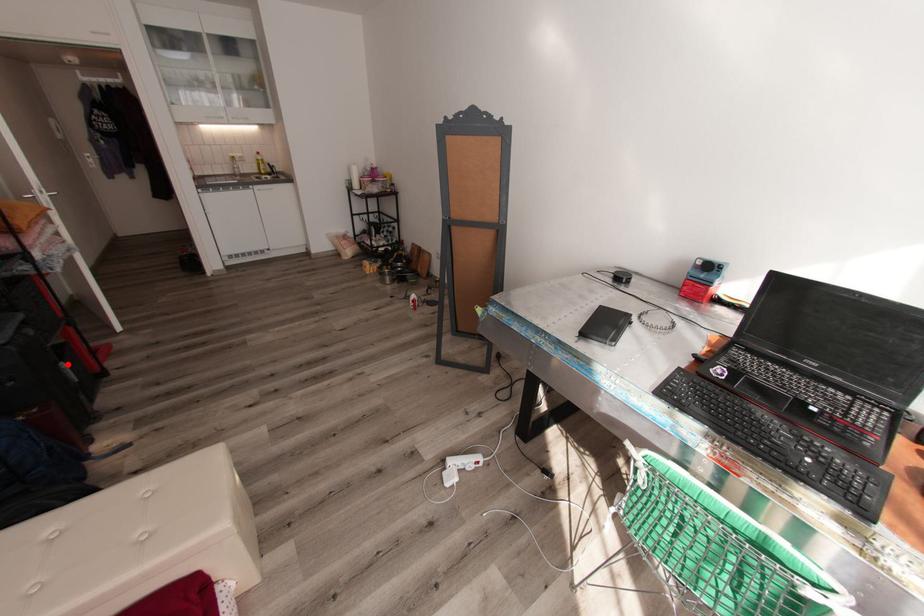
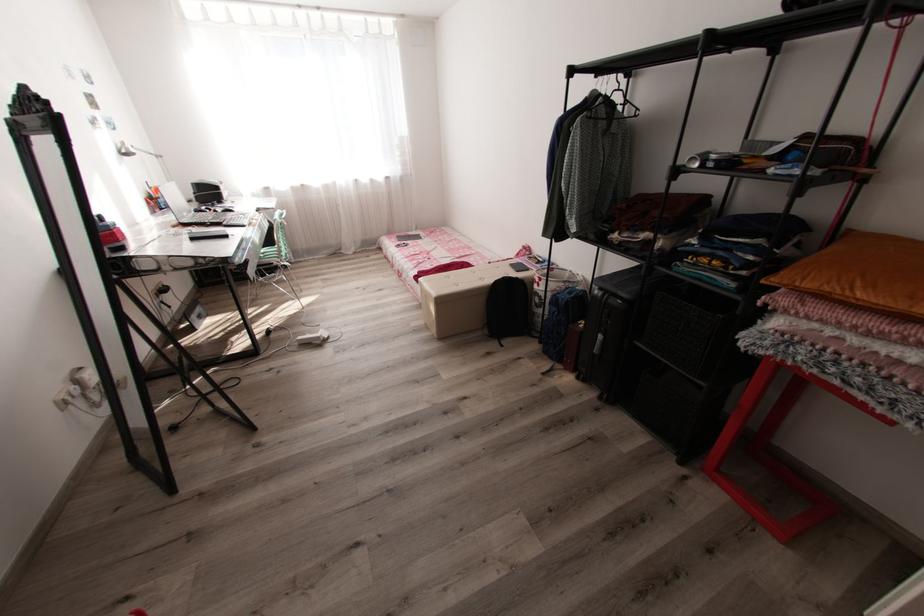
In the second image, find the point that corresponds to the highlighted location in the first image.

(603, 336)